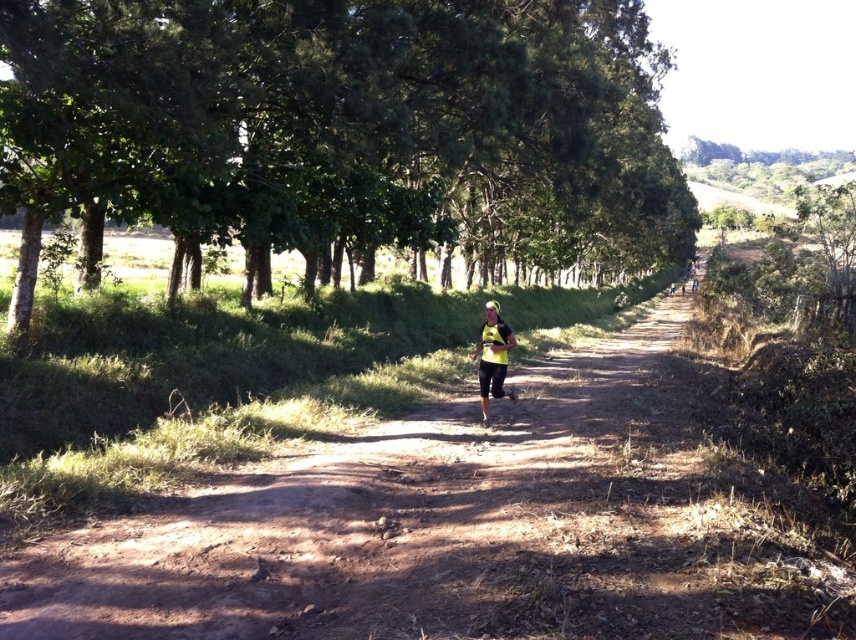
Question: Considering the relative positions of green leafy trees at center and yellow matte running outfit at center in the image provided, where is green leafy trees at center located with respect to yellow matte running outfit at center?

Choices:
 (A) right
 (B) left

Answer: (A)

Question: Which of the following is the farthest from the observer?

Choices:
 (A) yellow matte running outfit at center
 (B) green leafy trees at center

Answer: (A)

Question: Which of the following is the closest to the observer?

Choices:
 (A) green leafy trees at center
 (B) yellow matte running outfit at center

Answer: (A)

Question: Which point appears closest to the camera in this image?

Choices:
 (A) (230, 100)
 (B) (507, 328)

Answer: (B)

Question: Is green leafy trees at center above yellow matte running outfit at center?

Choices:
 (A) no
 (B) yes

Answer: (B)

Question: Is green leafy trees at center positioned in front of yellow matte running outfit at center?

Choices:
 (A) yes
 (B) no

Answer: (A)